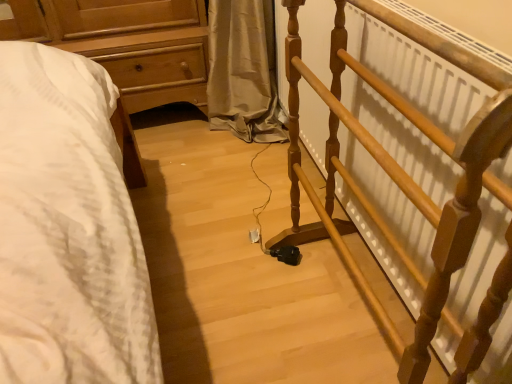
Where is `wooden spindle rail at right`? This screenshot has height=384, width=512. wooden spindle rail at right is located at coordinates (412, 189).

Describe the element at coordinates (412, 189) in the screenshot. I see `wooden spindle rail at right` at that location.

This screenshot has width=512, height=384. I want to click on wooden spindle rail at right, so click(x=412, y=189).